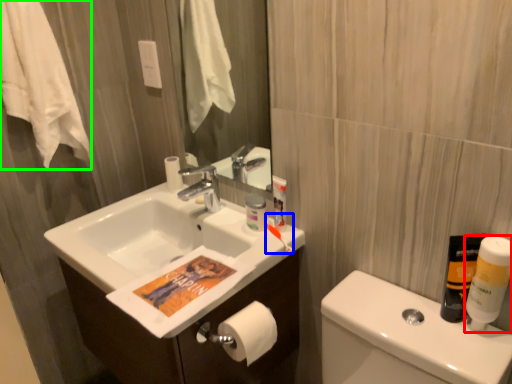
Question: Estimate the real-world distances between objects in this image. Which object is farther from mouthwash (highlighted by a red box), toothbrush (highlighted by a blue box) or bath towel (highlighted by a green box)?

Choices:
 (A) toothbrush
 (B) bath towel

Answer: (B)